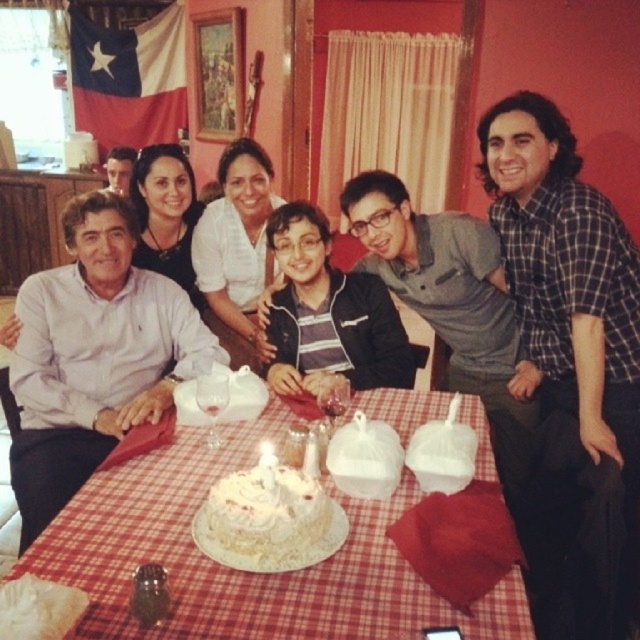
From the picture: Can you confirm if white cake at center is positioned below white frosted cake at center?

Correct, white cake at center is located below white frosted cake at center.

Can you confirm if white cake at center is thinner than white frosted cake at center?

No.

You are a GUI agent. You are given a task and a screenshot of the screen. Output one action in this format:
    pyautogui.click(x=<x>, y=<y>)
    Task: Click on the white cake at center
    
    Given the screenshot: What is the action you would take?
    pyautogui.click(x=244, y=572)

Locate an element on the screen. This screenshot has height=640, width=640. white cake at center is located at coordinates (244, 572).